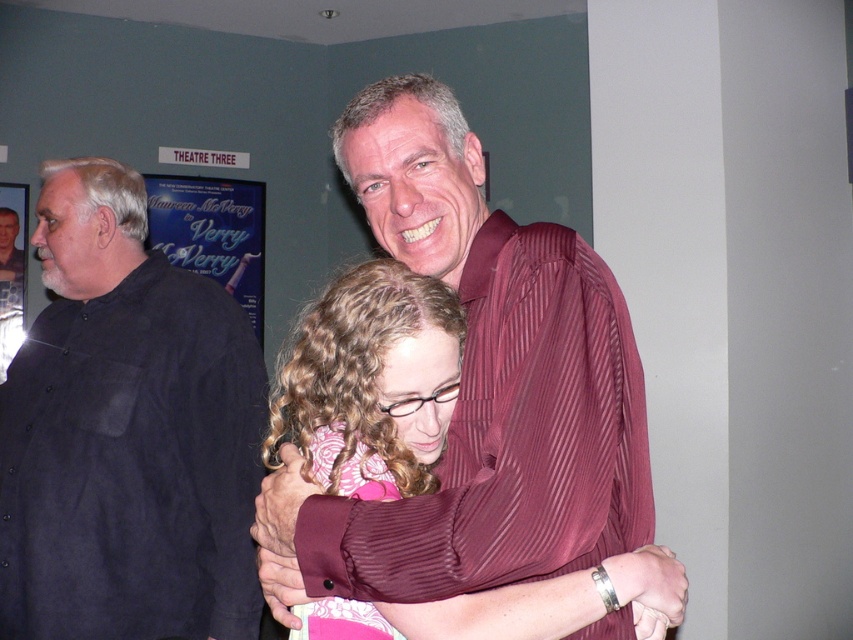
Question: Can you confirm if black matte shirt at left is positioned above pink fabric at center?

Choices:
 (A) no
 (B) yes

Answer: (B)

Question: Which point is farther from the camera taking this photo?

Choices:
 (A) (572, 620)
 (B) (3, 518)

Answer: (B)

Question: Among these points, which one is nearest to the camera?

Choices:
 (A) (334, 468)
 (B) (36, 376)

Answer: (A)

Question: Can you confirm if black matte shirt at left is bigger than pink fabric at center?

Choices:
 (A) no
 (B) yes

Answer: (B)

Question: Does black matte shirt at left appear over pink fabric at center?

Choices:
 (A) no
 (B) yes

Answer: (B)